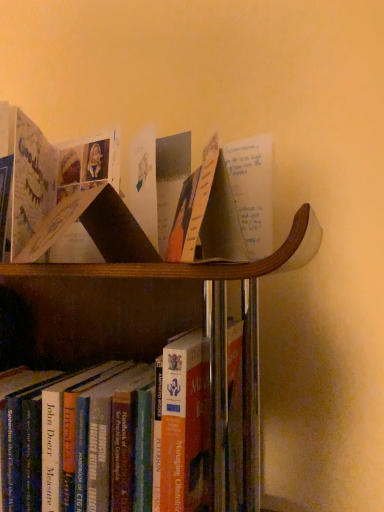
Question: From a real-world perspective, is matte paper book at center, marked as the 1th book in a top-to-bottom arrangement, physically located above or below matte paper book at center?

Choices:
 (A) below
 (B) above

Answer: (A)

Question: In terms of size, does matte paper book at center, marked as the 1th book in a top-to-bottom arrangement, appear bigger or smaller than matte paper book at center?

Choices:
 (A) small
 (B) big

Answer: (B)

Question: Which is nearer to the hardcover book at lower center, which is the first book from bottom to top?

Choices:
 (A) matte paper book at center, which is counted as the second book, starting from the bottom
 (B) matte paper book at center

Answer: (B)

Question: Estimate the real-world distances between objects in this image. Which object is closer to the hardcover book at lower center, which is the first book from bottom to top?

Choices:
 (A) matte paper book at center, marked as the 1th book in a top-to-bottom arrangement
 (B) matte paper book at center

Answer: (B)